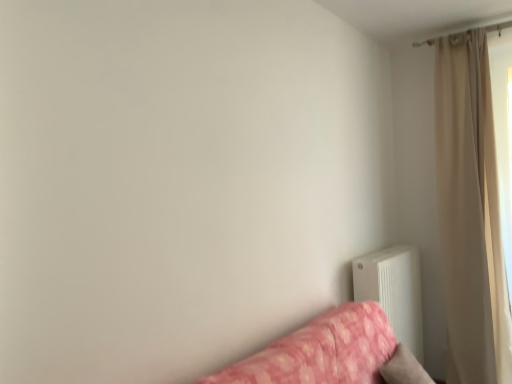
Question: Is the depth of pink floral fabric studio couch at lower right greater than that of beige fabric curtain at upper right?

Choices:
 (A) yes
 (B) no

Answer: (B)

Question: Is pink floral fabric studio couch at lower right shorter than beige fabric curtain at upper right?

Choices:
 (A) no
 (B) yes

Answer: (B)

Question: Does pink floral fabric studio couch at lower right have a greater width compared to beige fabric curtain at upper right?

Choices:
 (A) no
 (B) yes

Answer: (B)

Question: Is pink floral fabric studio couch at lower right directly adjacent to beige fabric curtain at upper right?

Choices:
 (A) yes
 (B) no

Answer: (B)

Question: Does pink floral fabric studio couch at lower right have a greater height compared to beige fabric curtain at upper right?

Choices:
 (A) yes
 (B) no

Answer: (B)

Question: From the image's perspective, is pink floral fabric studio couch at lower right on top of beige fabric curtain at upper right?

Choices:
 (A) no
 (B) yes

Answer: (A)

Question: Does beige fabric curtain at upper right have a larger size compared to white matte radiator at lower right?

Choices:
 (A) yes
 (B) no

Answer: (A)

Question: Could you tell me if beige fabric curtain at upper right is facing white matte radiator at lower right?

Choices:
 (A) no
 (B) yes

Answer: (A)

Question: Can you confirm if beige fabric curtain at upper right is wider than white matte radiator at lower right?

Choices:
 (A) no
 (B) yes

Answer: (B)

Question: Can you confirm if beige fabric curtain at upper right is smaller than white matte radiator at lower right?

Choices:
 (A) yes
 (B) no

Answer: (B)

Question: From a real-world perspective, is beige fabric curtain at upper right positioned under white matte radiator at lower right based on gravity?

Choices:
 (A) yes
 (B) no

Answer: (B)

Question: Is beige fabric curtain at upper right positioned before white matte radiator at lower right?

Choices:
 (A) no
 (B) yes

Answer: (A)

Question: Is white matte radiator at lower right behind beige fabric curtain at upper right?

Choices:
 (A) yes
 (B) no

Answer: (B)